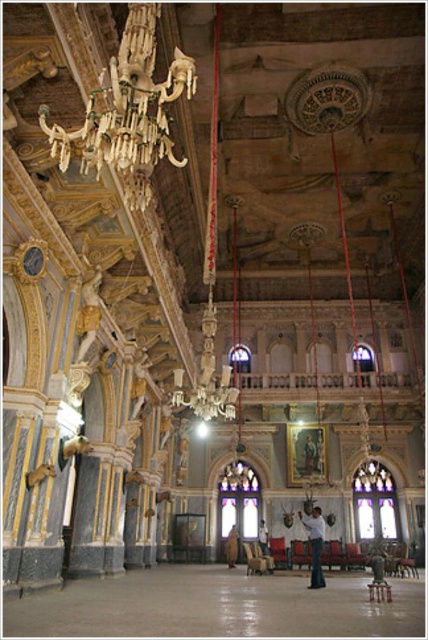
Which of these two, light brown leather jacket at center or wooden framed portrait at center, stands taller?

light brown leather jacket at center

Who is positioned more to the right, light brown leather jacket at center or wooden framed portrait at center?

wooden framed portrait at center

Between point (321, 580) and point (308, 440), which one is positioned in front?

Point (321, 580) is more forward.

Image resolution: width=428 pixels, height=640 pixels. What are the coordinates of `light brown leather jacket at center` in the screenshot? It's located at (315, 545).

Based on the photo, between wooden framed portrait at center and white fabric at center, which one has less height?

Standing shorter between the two is white fabric at center.

Is point (309, 433) positioned behind point (265, 531)?

Yes, it is behind point (265, 531).

Identify the location of wooden framed portrait at center. (311, 454).

Does gold metallic chandelier at upper center appear on the left side of wooden framed portrait at center?

Yes, gold metallic chandelier at upper center is to the left of wooden framed portrait at center.

The image size is (428, 640). What are the coordinates of `gold metallic chandelier at upper center` in the screenshot? It's located at (127, 109).